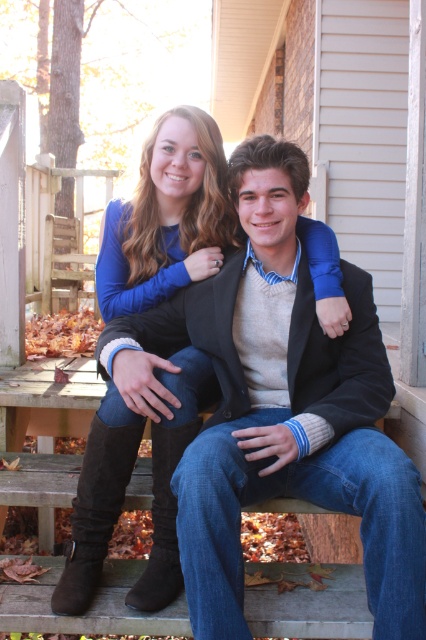
You are standing on the grass looking at the two people sitting on the bench. Which of the boots, the suede boots at lower left or the brown suede boot at lower left, is closer to your eye level?

The suede boots at lower left is closer to your eye level because it is positioned above the brown suede boot at lower left.